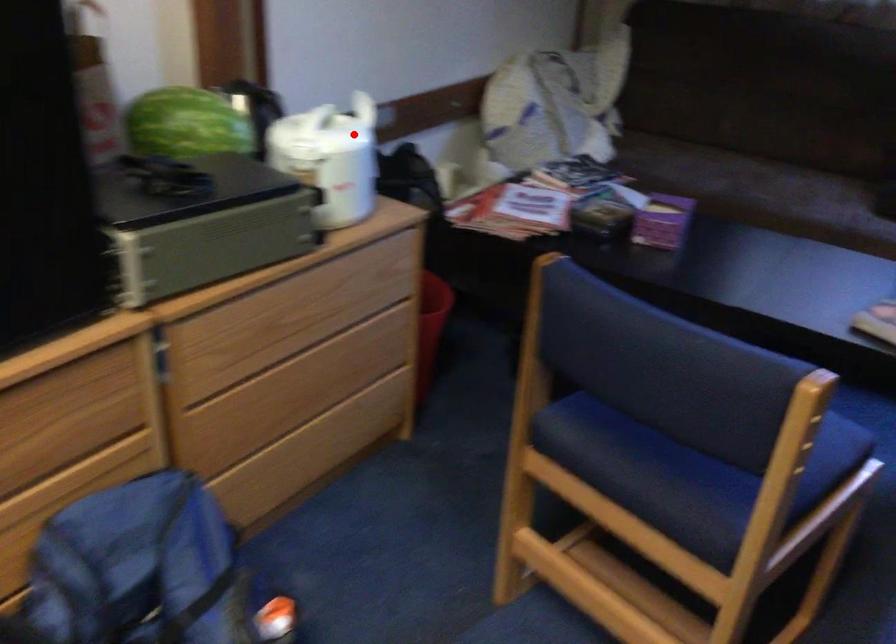
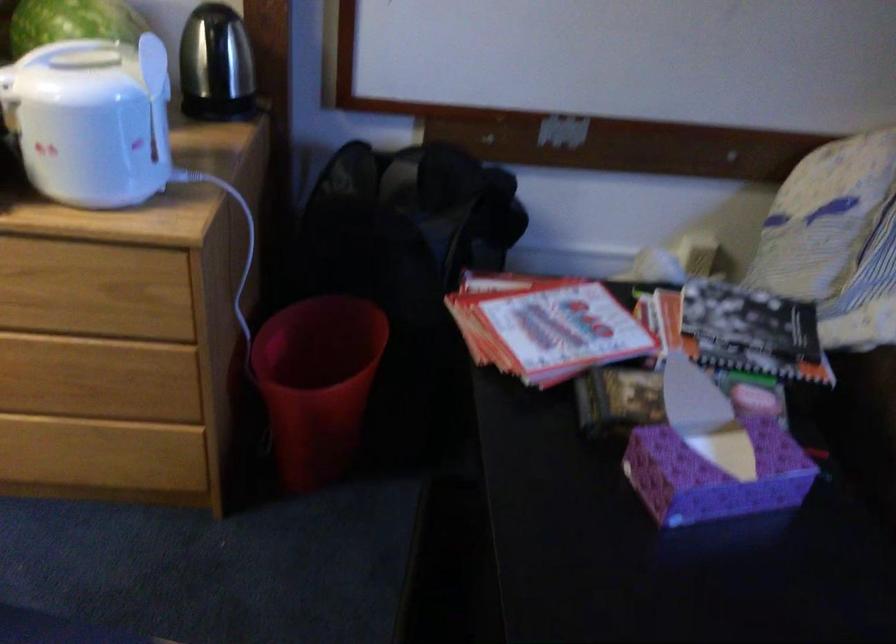
Find the pixel in the second image that matches the highlighted location in the first image.

(156, 97)